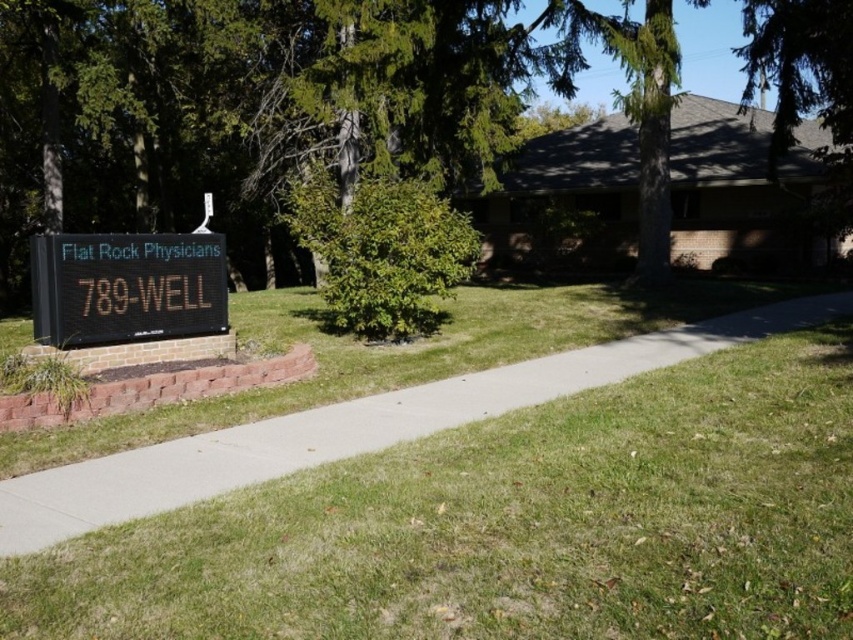
Does point (259, 1) lie behind point (532, 381)?

Yes, it is behind point (532, 381).

Between green leafy tree at center and concrete at left, which one appears on the left side from the viewer's perspective?

green leafy tree at center

At what (x,y) coordinates should I click in order to perform the action: click on green leafy tree at center. Please return your answer as a coordinate pair (x, y). Looking at the image, I should click on (253, 104).

Does concrete at left appear on the right side of black digital sign at lower left?

Correct, you'll find concrete at left to the right of black digital sign at lower left.

Does point (369, 442) come in front of point (61, 276)?

Yes.

Image resolution: width=853 pixels, height=640 pixels. Identify the location of concrete at left. (352, 428).

Does point (204, 0) come in front of point (154, 282)?

No, (204, 0) is behind (154, 282).

Is green leafy tree at center thinner than black digital sign at lower left?

Incorrect, green leafy tree at center's width is not less than black digital sign at lower left's.

This screenshot has height=640, width=853. Identify the location of green leafy tree at center. (253, 104).

Locate an element on the screen. This screenshot has width=853, height=640. green leafy tree at center is located at coordinates (253, 104).